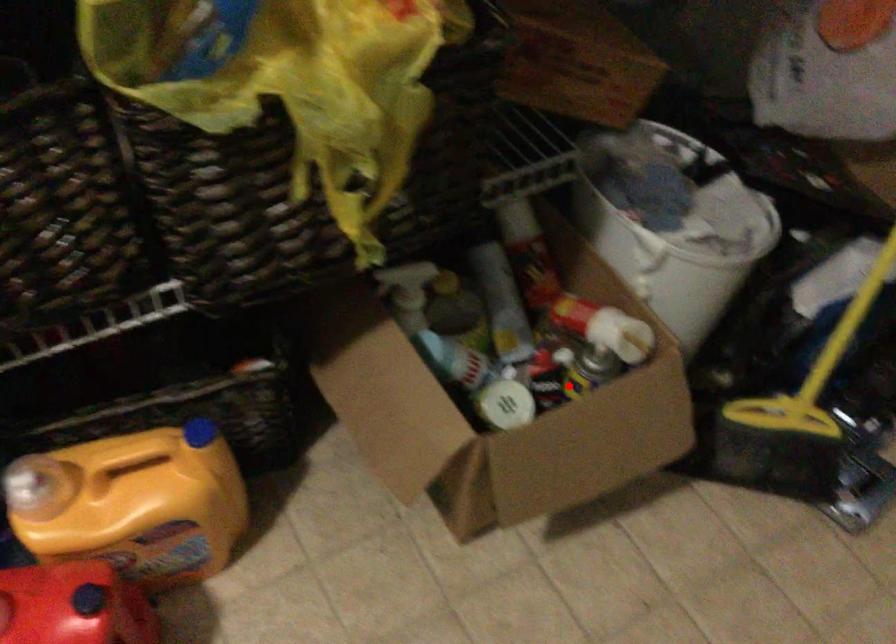
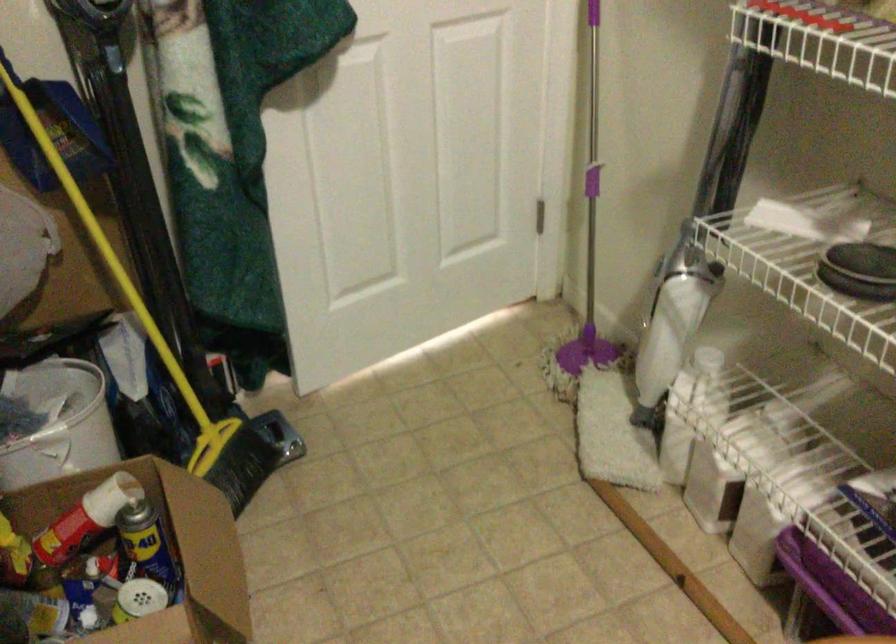
Find the pixel in the second image that matches the highlighted location in the first image.

(147, 547)